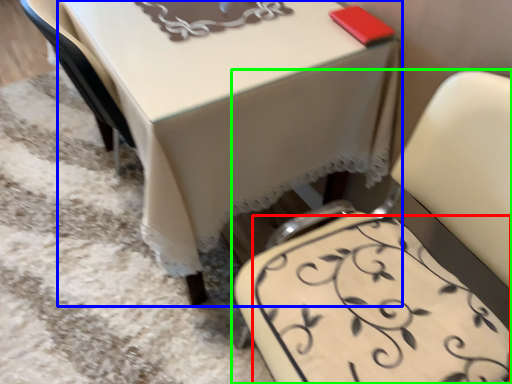
Question: Which object is the closest to the design (highlighted by a red box)? Choose among these: table (highlighted by a blue box) or chair (highlighted by a green box).

Choices:
 (A) table
 (B) chair

Answer: (B)